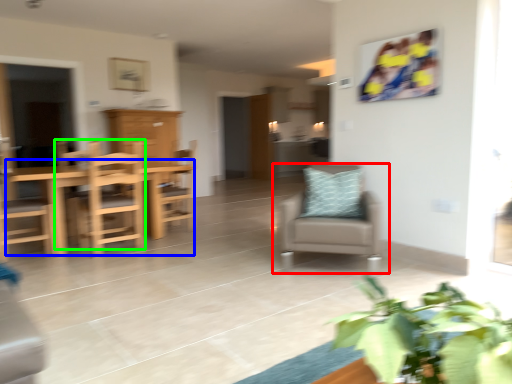
Question: Which is nearer to the chair (highlighted by a red box)? table (highlighted by a blue box) or chair (highlighted by a green box).

Choices:
 (A) table
 (B) chair

Answer: (B)